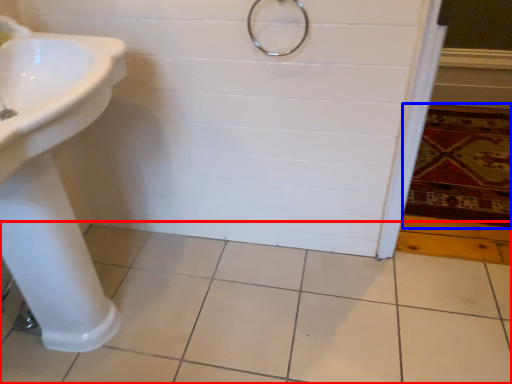
Question: Which of the following is the farthest to the observer, ceramic tile (highlighted by a red box) or bath mat (highlighted by a blue box)?

Choices:
 (A) ceramic tile
 (B) bath mat

Answer: (B)